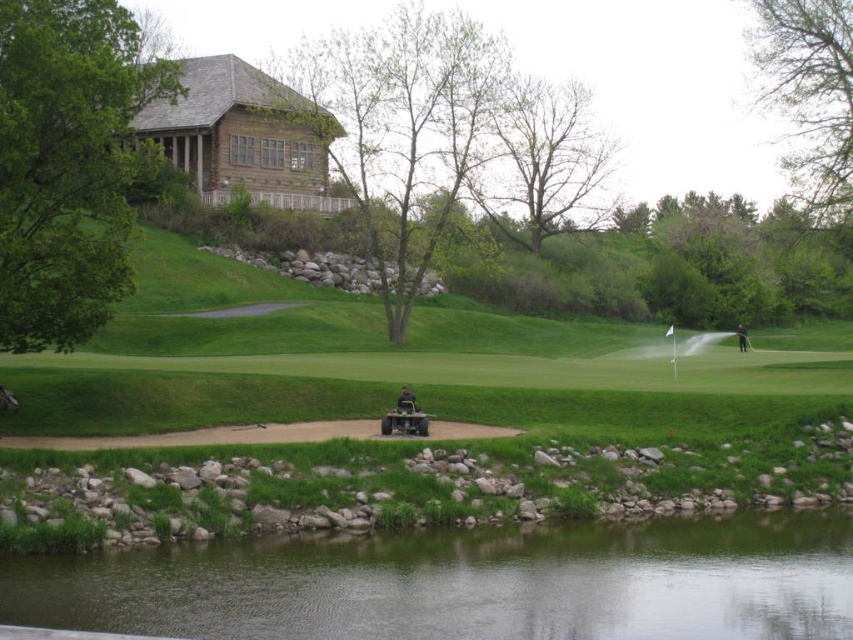
You are a golfer preparing to hit a ball from the tee box near the water. You notice the transparent water at lower center and the green fabric shirt at center in your line of sight. Which object appears bigger in your view?

The transparent water at lower center appears bigger because it has a larger size compared to the green fabric shirt at center.

You are a golfer preparing to putt on the green. You have a transparent water at lower center and a green fabric shirt at center in your line of sight. Which object is closer to the putting green?

The transparent water at lower center is shorter than green fabric shirt at center, so the transparent water at lower center is closer to the putting green.

You are a golfer standing at the point marked by the white flag on the putting green. You want to hit a ball to the point labeled as point (119,614). The ball you are using has a maximum driving distance of 200 meters. Can you reach the target point with one shot?

The distance between the viewer and point (119,614) is 18.53 meters. Since the ball can travel up to 200 meters, you can easily reach the target point with one shot.